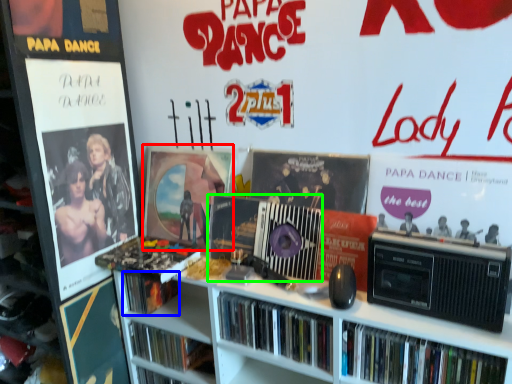
Question: Which is farther away from poster page (highlighted by a red box)? book (highlighted by a blue box) or cassette (highlighted by a green box)?

Choices:
 (A) book
 (B) cassette

Answer: (A)